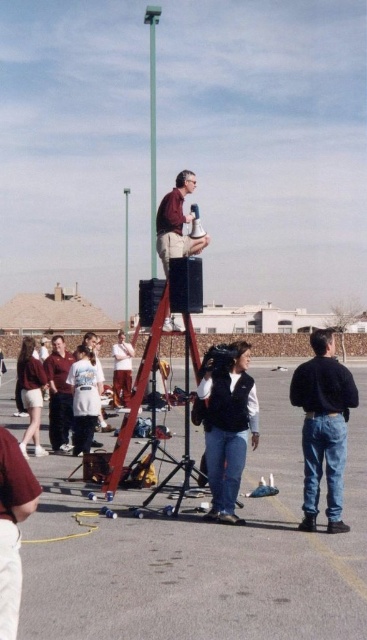
You are a photographer adjusting the focus on your camera. You notice two points in the scene at coordinates point (281, 452) and point (241, 424). Which point is closer to the camera?

Point (241, 424) is closer to the camera than point (281, 452) because the description states that point (281, 452) is further away.

You are directing a film scene and need to ensure the matte maroon hoodie at left is visible in the camera frame. Given that the denim vest at center is blocking part of the view, which clothing item should you adjust to achieve this?

The matte maroon hoodie at left is behind the denim vest at center. To make the matte maroon hoodie at left visible, you should move the denim vest at center out of the way or adjust the camera angle to avoid blocking it.

You are a photographer trying to capture both the denim vest at center and the matte maroon hoodie at left in a single frame. Given their sizes, which one might require you to step back to include fully in the photo?

The matte maroon hoodie at left occupies more space than the denim vest at center, so you would need to step back to include the matte maroon hoodie at left fully in the photo.